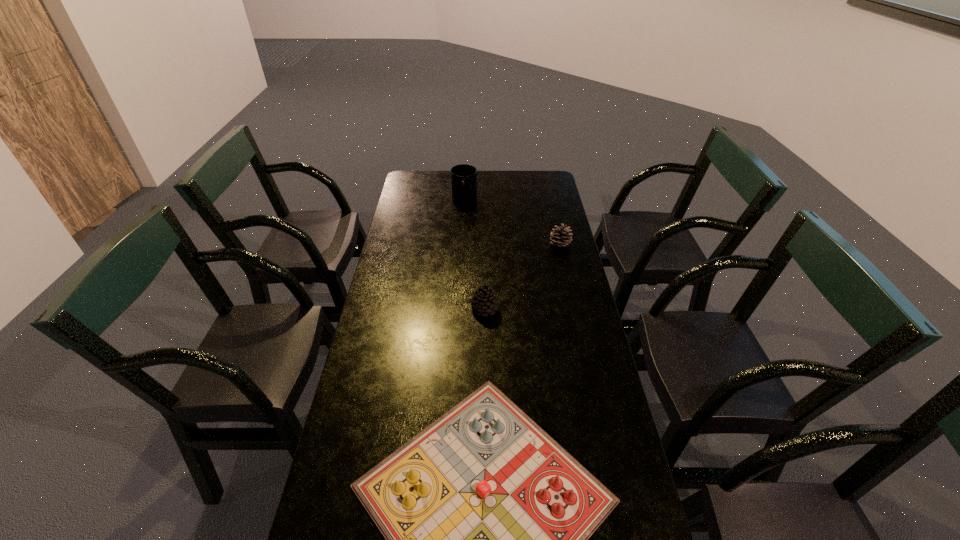
Where is `vacant space that satisfies the following two spatial constraints: 1. on the side of the right pinecone with the handle; 2. on the right side of the tallest object`? vacant space that satisfies the following two spatial constraints: 1. on the side of the right pinecone with the handle; 2. on the right side of the tallest object is located at coordinates (462, 245).

This screenshot has height=540, width=960. In order to click on vacant area in the image that satisfies the following two spatial constraints: 1. on the side of the right pinecone with the handle; 2. on the right side of the mug in this screenshot , I will do `click(462, 245)`.